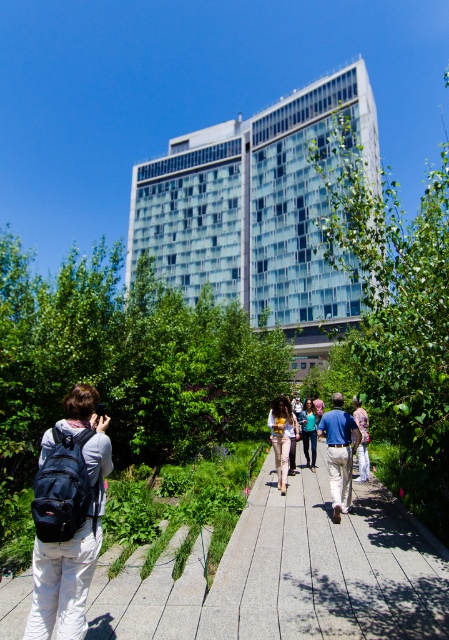
Question: Observing the image, what is the correct spatial positioning of gray concrete pavement at center in reference to blue denim jacket at center?

Choices:
 (A) right
 (B) left

Answer: (B)

Question: Which object is positioned farthest from the yellow fabric dress at center?

Choices:
 (A) matte black backpack at lower left
 (B) blue denim jeans at center
 (C) blue denim jacket at center

Answer: (A)

Question: Can you confirm if gray concrete pavement at center is smaller than blue denim jacket at center?

Choices:
 (A) yes
 (B) no

Answer: (A)

Question: Where is gray concrete pavement at center located in relation to blue denim jeans at center in the image?

Choices:
 (A) below
 (B) above

Answer: (A)

Question: Which point is farther to the camera?

Choices:
 (A) blue denim jeans at center
 (B) gray concrete pavement at center
 (C) matte black backpack at lower left
 (D) blue denim jacket at center

Answer: (A)

Question: Which of these objects is positioned closest to the yellow fabric dress at center?

Choices:
 (A) matte black backpack at lower left
 (B) gray concrete pavement at center

Answer: (B)